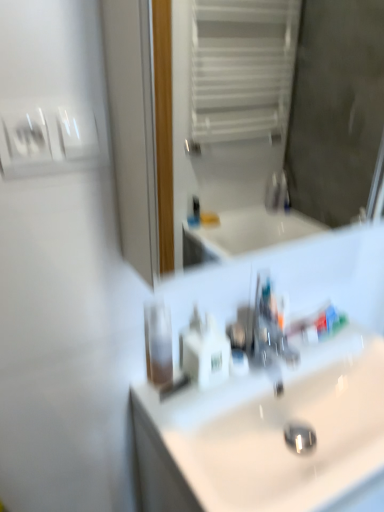
This screenshot has width=384, height=512. I want to click on free space in front of transparent plastic mouthwash at center, so click(x=177, y=422).